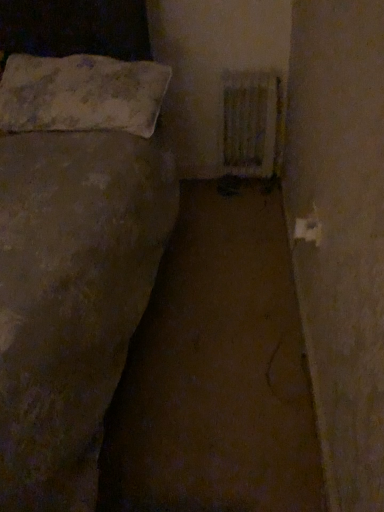
Question: Considering the relative sizes of white textured radiator at upper right and white textured pillow at upper left in the image provided, is white textured radiator at upper right thinner than white textured pillow at upper left?

Choices:
 (A) yes
 (B) no

Answer: (A)

Question: Does white textured radiator at upper right lie in front of white textured pillow at upper left?

Choices:
 (A) yes
 (B) no

Answer: (B)

Question: Can you confirm if white textured radiator at upper right is taller than white textured pillow at upper left?

Choices:
 (A) no
 (B) yes

Answer: (B)

Question: Are white textured radiator at upper right and white textured pillow at upper left located far from each other?

Choices:
 (A) yes
 (B) no

Answer: (B)

Question: From a real-world perspective, does white textured radiator at upper right stand above white textured pillow at upper left?

Choices:
 (A) yes
 (B) no

Answer: (B)

Question: From the image's perspective, does white textured radiator at upper right appear higher than white textured pillow at upper left?

Choices:
 (A) yes
 (B) no

Answer: (B)

Question: Is white textured pillow at upper left bigger than white textured radiator at upper right?

Choices:
 (A) yes
 (B) no

Answer: (A)

Question: Is white textured pillow at upper left further to camera compared to white textured radiator at upper right?

Choices:
 (A) no
 (B) yes

Answer: (A)

Question: Considering the relative positions of white textured pillow at upper left and white textured radiator at upper right in the image provided, is white textured pillow at upper left to the right of white textured radiator at upper right from the viewer's perspective?

Choices:
 (A) no
 (B) yes

Answer: (A)

Question: Does white textured pillow at upper left have a lesser height compared to white textured radiator at upper right?

Choices:
 (A) no
 (B) yes

Answer: (B)

Question: Is white textured pillow at upper left surrounding white textured radiator at upper right?

Choices:
 (A) no
 (B) yes

Answer: (A)

Question: Is white textured pillow at upper left to the left of white textured radiator at upper right from the viewer's perspective?

Choices:
 (A) no
 (B) yes

Answer: (B)

Question: In terms of size, does white textured radiator at upper right appear bigger or smaller than white textured pillow at upper left?

Choices:
 (A) small
 (B) big

Answer: (A)